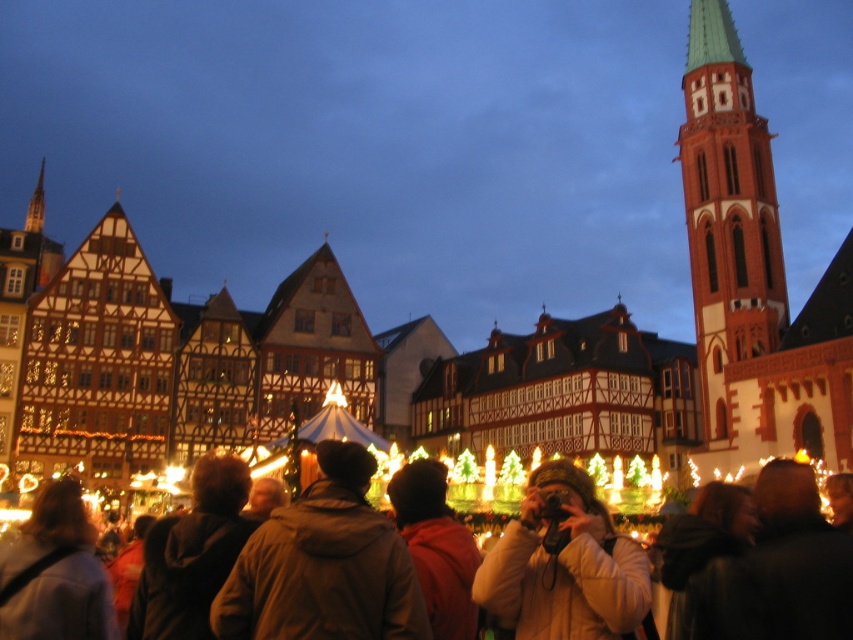
You are standing at the edge of the crowd at the Christmas market. You see a person wearing a brown fuzzy jacket at center and someone holding a camera. How far apart are these two individuals?

The brown fuzzy jacket at center and camera are 115.19 feet apart from each other.

You are a photographer at the Christmas market and want to take a photo of the crowd. You notice two coats in the center of the image. Which coat is shorter, the white fluffy coat at center or the brown leather jacket at center?

The white fluffy coat at center is shorter than the brown leather jacket at center.

You are standing in the crowd at the Christmas market and see both the brown leather jacket at center and the red jacket at center. Which jacket is closer to you?

The brown leather jacket at center is closer to you because it is in front of the red jacket at center.